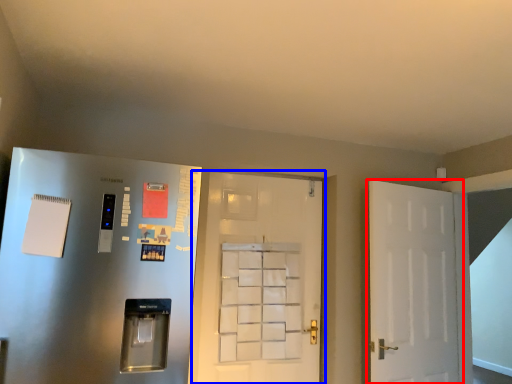
Question: Which object appears closest to the camera in this image, door (highlighted by a red box) or door (highlighted by a blue box)?

Choices:
 (A) door
 (B) door

Answer: (A)